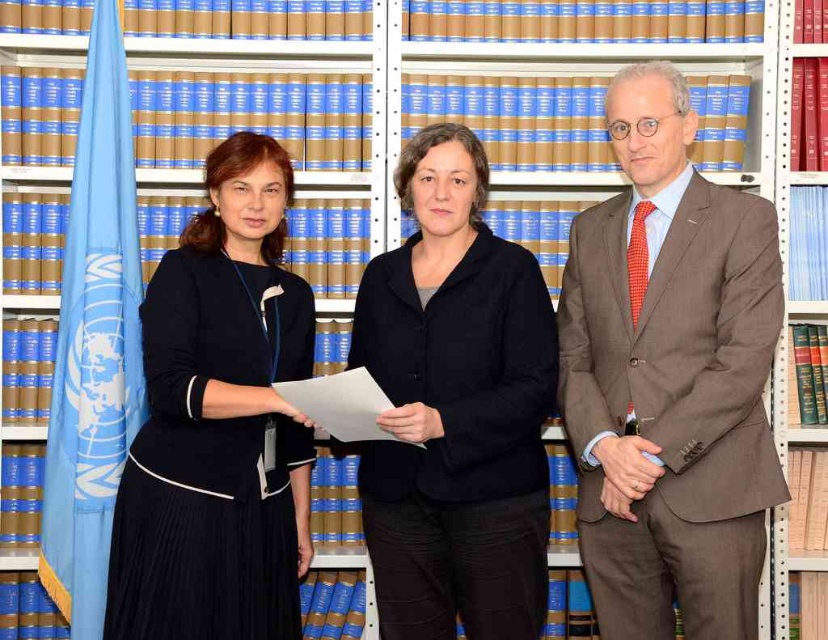
Does brown suit at center appear on the right side of matte black dress at center?

Yes, brown suit at center is to the right of matte black dress at center.

Does brown suit at center appear over matte black dress at center?

Yes.

You are a GUI agent. You are given a task and a screenshot of the screen. Output one action in this format:
    pyautogui.click(x=<x>, y=<y>)
    Task: Click on the brown suit at center
    Image resolution: width=828 pixels, height=640 pixels.
    Given the screenshot: What is the action you would take?
    pyautogui.click(x=670, y=378)

Is brown suit at center positioned at the back of black matte blazer at center?

Yes, it is behind black matte blazer at center.

Is point (662, 464) positioned in front of point (366, 340)?

Yes, point (662, 464) is closer to viewer.

This screenshot has width=828, height=640. I want to click on brown suit at center, so click(x=670, y=378).

Does black matte blazer at center have a lesser height compared to matte black dress at center?

Incorrect, black matte blazer at center's height does not fall short of matte black dress at center's.

Is black matte blazer at center positioned at the back of matte black dress at center?

Yes, black matte blazer at center is further from the viewer.

Is point (475, 621) farther from viewer compared to point (207, 380)?

Yes, it is behind point (207, 380).

I want to click on black matte blazer at center, so click(455, 408).